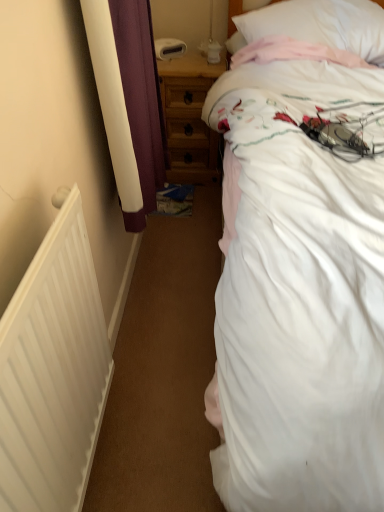
Question: Does wooden nightstand at center have a greater height compared to white matte radiator at left?

Choices:
 (A) yes
 (B) no

Answer: (B)

Question: From the image's perspective, is wooden nightstand at center located above white matte radiator at left?

Choices:
 (A) yes
 (B) no

Answer: (A)

Question: From a real-world perspective, is wooden nightstand at center below white matte radiator at left?

Choices:
 (A) no
 (B) yes

Answer: (B)

Question: Is wooden nightstand at center at the right side of white matte radiator at left?

Choices:
 (A) no
 (B) yes

Answer: (B)

Question: Considering the relative sizes of wooden nightstand at center and white matte radiator at left in the image provided, is wooden nightstand at center thinner than white matte radiator at left?

Choices:
 (A) no
 (B) yes

Answer: (A)

Question: From a real-world perspective, is wooden nightstand at center physically above white matte radiator at left?

Choices:
 (A) no
 (B) yes

Answer: (A)

Question: From a real-world perspective, does white cotton bed at upper right sit lower than white soft pillow at upper right?

Choices:
 (A) yes
 (B) no

Answer: (A)

Question: Would you say white cotton bed at upper right contains white soft pillow at upper right?

Choices:
 (A) yes
 (B) no

Answer: (A)

Question: Considering the relative sizes of white cotton bed at upper right and white soft pillow at upper right in the image provided, is white cotton bed at upper right thinner than white soft pillow at upper right?

Choices:
 (A) yes
 (B) no

Answer: (B)

Question: Can you confirm if white cotton bed at upper right is smaller than white soft pillow at upper right?

Choices:
 (A) no
 (B) yes

Answer: (A)

Question: Can we say white cotton bed at upper right lies outside white soft pillow at upper right?

Choices:
 (A) yes
 (B) no

Answer: (A)

Question: Does white cotton bed at upper right have a larger size compared to white soft pillow at upper right?

Choices:
 (A) no
 (B) yes

Answer: (B)

Question: Is white soft pillow at upper right placed right next to white cotton bed at upper right?

Choices:
 (A) no
 (B) yes

Answer: (A)